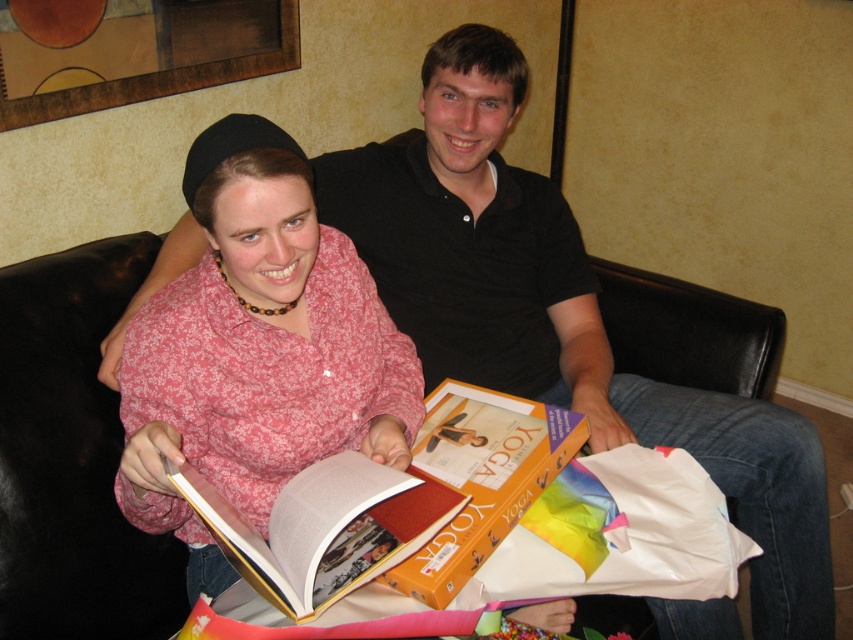
Question: Can you confirm if pink floral shirt at center is positioned above hardcover book at center?

Choices:
 (A) yes
 (B) no

Answer: (A)

Question: Among these objects, which one is farthest from the camera?

Choices:
 (A) hardcover book at center
 (B) pink floral shirt at center
 (C) orange matte/yellowish book at center

Answer: (C)

Question: Which point appears farthest from the camera in this image?

Choices:
 (A) (309, 397)
 (B) (550, 435)

Answer: (B)

Question: Where is hardcover book at center located in relation to orange matte/yellowish book at center in the image?

Choices:
 (A) above
 (B) below

Answer: (B)

Question: Does pink floral shirt at center come in front of orange matte/yellowish book at center?

Choices:
 (A) no
 (B) yes

Answer: (B)

Question: Which point is farther to the camera?

Choices:
 (A) (169, 358)
 (B) (285, 506)

Answer: (A)